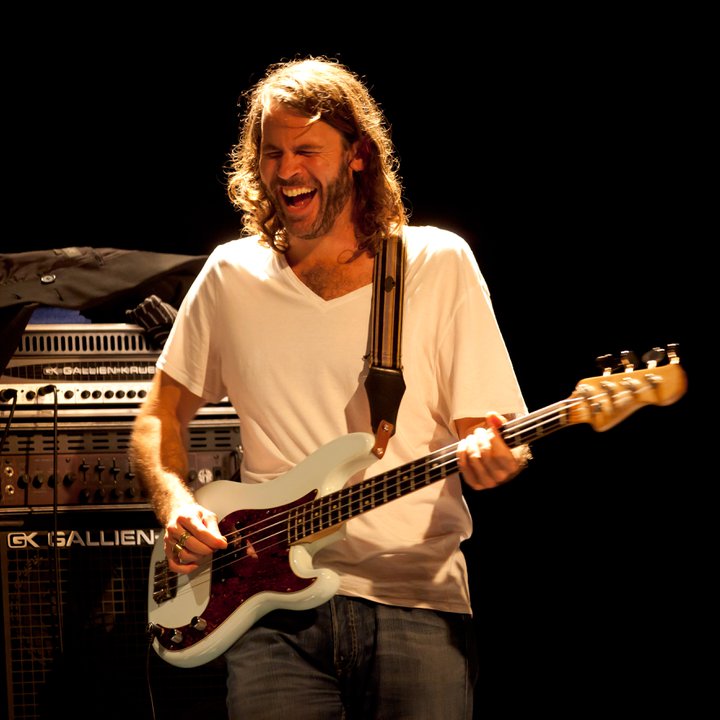
At what (x,y) coordinates should I click in order to perform the action: click on amplifier. Please return your answer as a coordinate pair (x, y). Looking at the image, I should click on (68, 404).